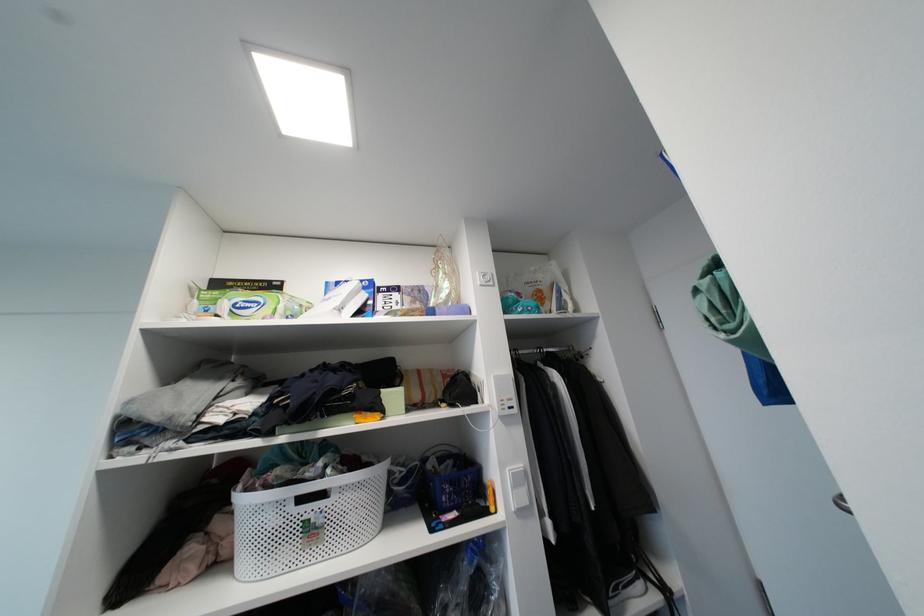
The width and height of the screenshot is (924, 616). Describe the element at coordinates (517, 485) in the screenshot. I see `a white wall thermostat` at that location.